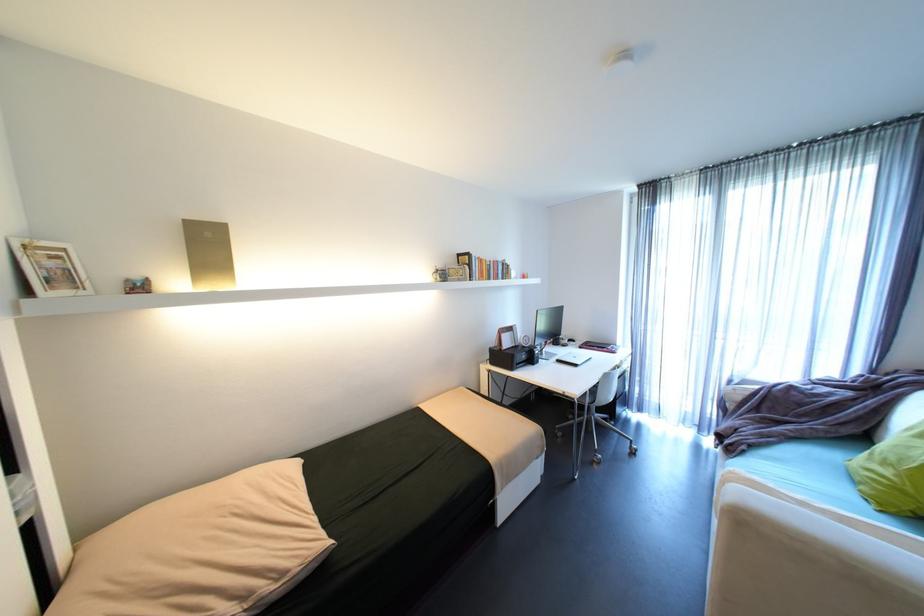
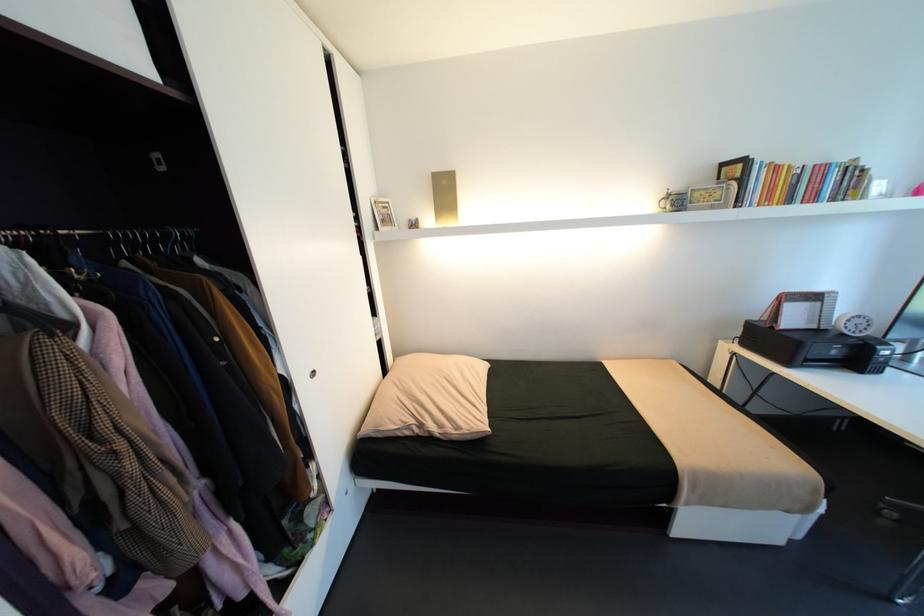
Find the pixel in the second image that matches point (507, 350) in the first image.

(779, 328)